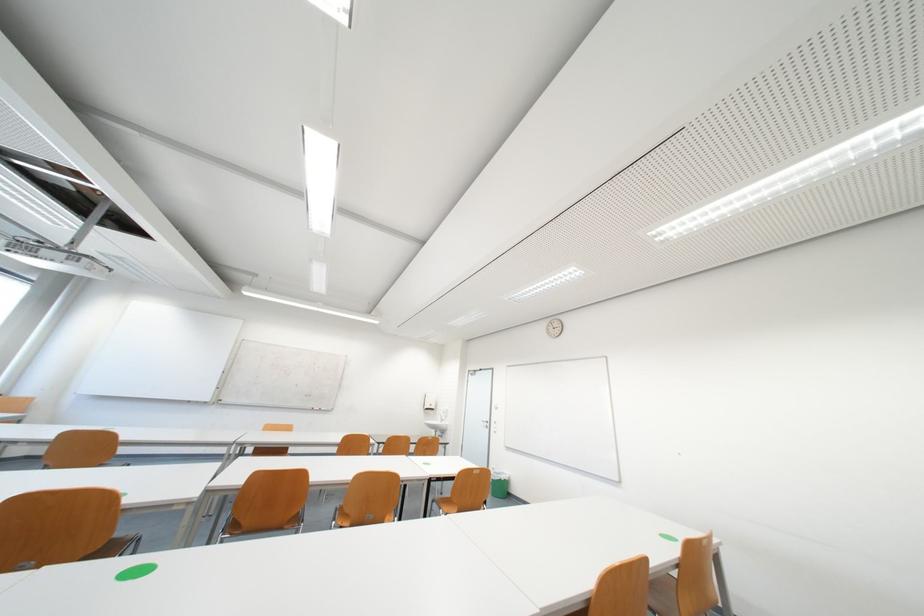
Where would you sit the chair sitting surface? Please return your answer as a coordinate pair (x, y).

(445, 505)